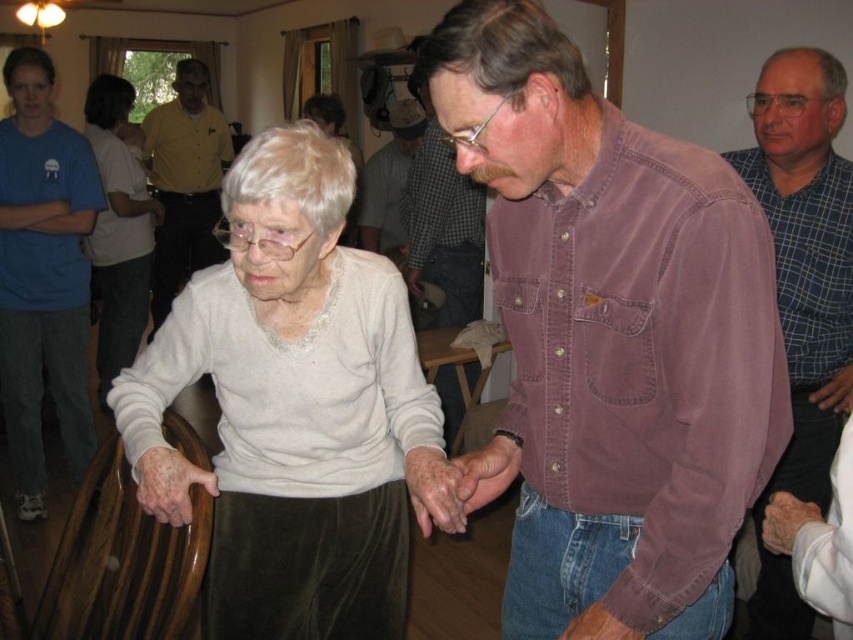
You are a photographer trying to capture a candid shot of both the light beige sweater at center and the brown corduroy shirt at center. Based on their heights, which one should you focus on first to ensure both are in frame?

The light beige sweater at center is shorter than the brown corduroy shirt at center, so you should focus on the brown corduroy shirt at center first to ensure both are in frame.

You are at a social gathering and want to find the matte brown shirt at center. Where should you look relative to the white matte sweater at upper left?

The matte brown shirt at center is positioned under the white matte sweater at upper left, so you should look downward from the white matte sweater at upper left to find it.

You are organizing a clothing donation drive and need to determine which of the two shirts, the checkered fabric shirt at upper right or the plaid shirt at center, can fit into a donation box that has a width capacity of 40 cm. According to the description, which shirt is more likely to fit?

The checkered fabric shirt at upper right has a smaller width than the plaid shirt at center, so it is more likely to fit into the donation box with a 40 cm width capacity.